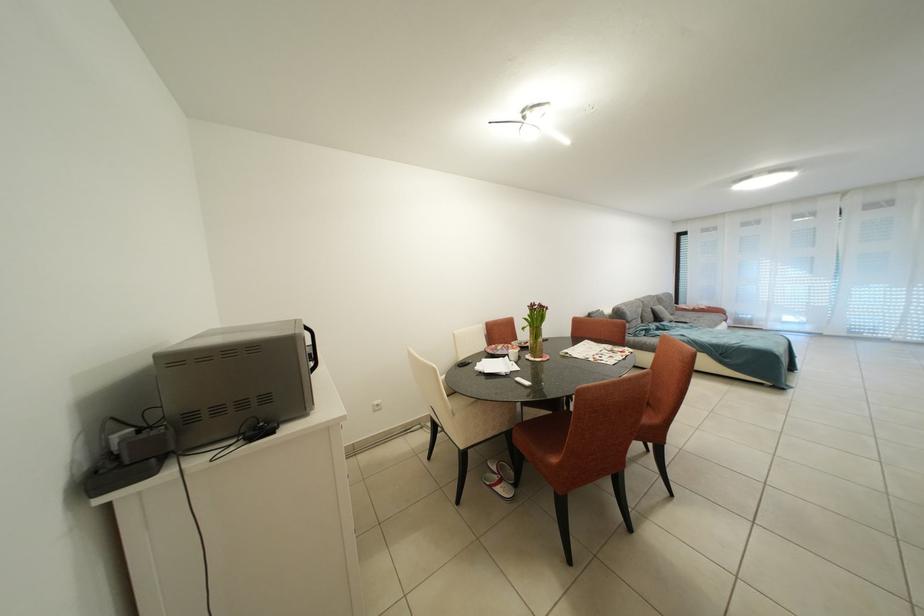
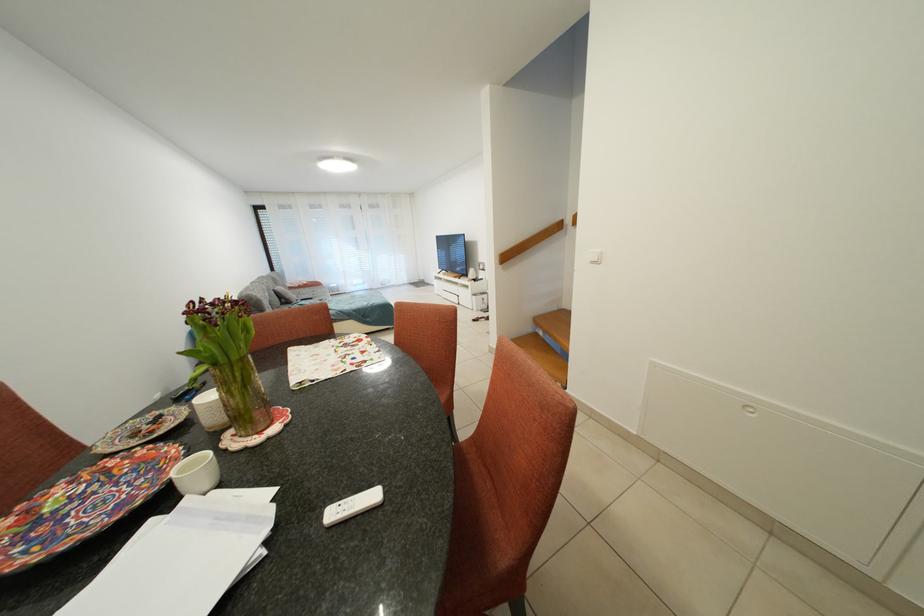
The point at (x=521, y=357) is marked in the first image. Where is the corresponding point in the second image?

(202, 471)